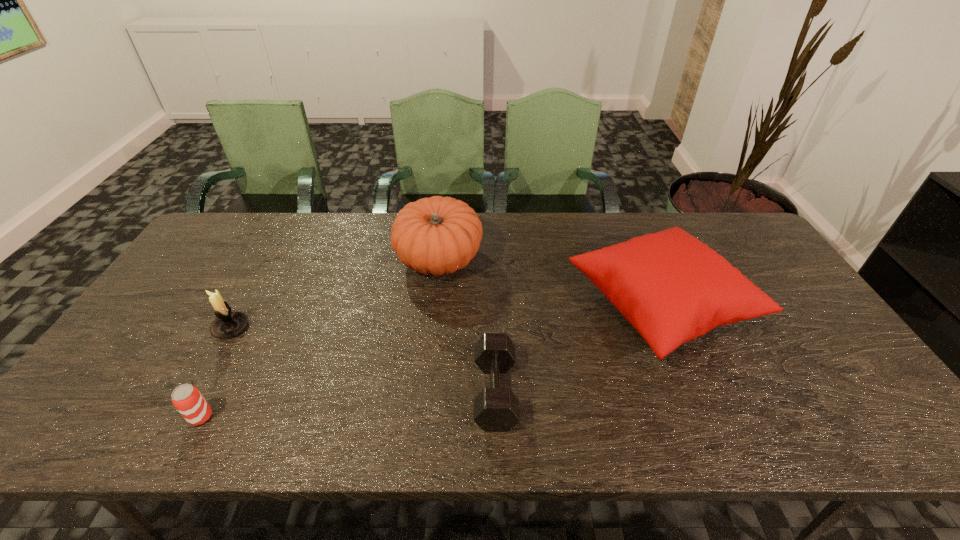
Identify the location of pumpkin at the far edge. The height and width of the screenshot is (540, 960). (438, 235).

Identify the location of cushion at the far edge. The image size is (960, 540). (671, 287).

You are a GUI agent. You are given a task and a screenshot of the screen. Output one action in this format:
    pyautogui.click(x=<x>, y=<y>)
    Task: Click on the beer can present at the near edge
    
    Given the screenshot: What is the action you would take?
    pyautogui.click(x=187, y=399)

This screenshot has width=960, height=540. Identify the location of dumbbell at the near edge. [496, 409].

The width and height of the screenshot is (960, 540). What are the coordinates of `object that is at the right edge` in the screenshot? It's located at (671, 287).

At what (x,y) coordinates should I click in order to perform the action: click on object positioned at the far right corner. Please return your answer as a coordinate pair (x, y). Looking at the image, I should click on (671, 287).

Image resolution: width=960 pixels, height=540 pixels. What are the coordinates of `blank space at the far edge` in the screenshot? It's located at (684, 215).

Identify the location of vacant space at the near edge of the desktop. (521, 433).

In the image, there is a desktop. At what (x,y) coordinates should I click in order to perform the action: click on vacant area at the left edge. Please return your answer as a coordinate pair (x, y). The image size is (960, 540). Looking at the image, I should click on (177, 310).

At what (x,y) coordinates should I click in order to perform the action: click on vacant area at the far left corner of the desktop. Please return your answer as a coordinate pair (x, y). The width and height of the screenshot is (960, 540). Looking at the image, I should click on (223, 214).